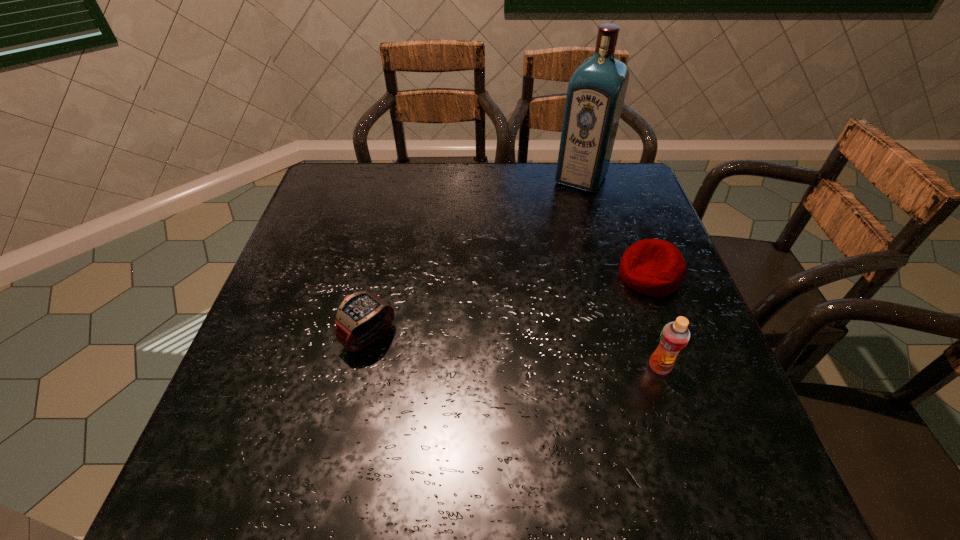
Find the location of `watch`. watch is located at coordinates (363, 317).

I want to click on the leftmost object, so click(363, 317).

Find the location of a particular element. the second tallest object is located at coordinates (674, 337).

Identify the location of the second farthest object. (653, 267).

Locate an element on the screen. The height and width of the screenshot is (540, 960). the shortest object is located at coordinates (653, 267).

Locate an element on the screen. The height and width of the screenshot is (540, 960). liquor is located at coordinates (596, 92).

The image size is (960, 540). In order to click on the tallest object in this screenshot , I will do `click(596, 92)`.

The height and width of the screenshot is (540, 960). I want to click on free space located 0.080m on the back of the leftmost object, so click(x=380, y=288).

Locate an element on the screen. vacant region located on the left of the second tallest object is located at coordinates (566, 367).

You are a GUI agent. You are given a task and a screenshot of the screen. Output one action in this format:
    pyautogui.click(x=<x>, y=<y>)
    Task: Click on the vacant space situated 0.260m on the seat area of the second farthest object
    This screenshot has height=540, width=960.
    Given the screenshot: What is the action you would take?
    pyautogui.click(x=529, y=326)